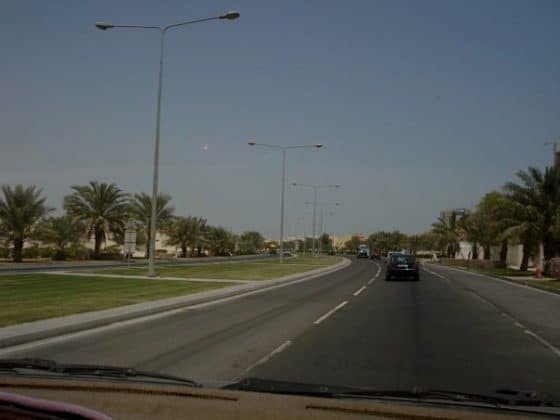
The width and height of the screenshot is (560, 420). What are the coordinates of `lamp lights` in the screenshot? It's located at (232, 14), (102, 26).